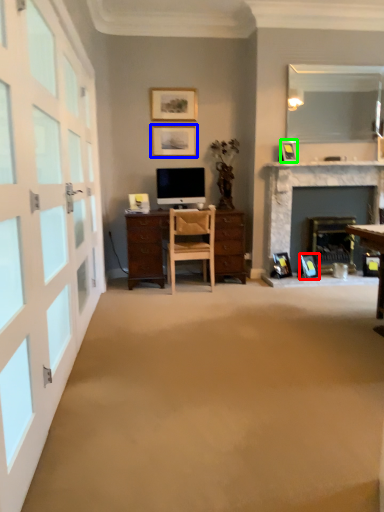
Question: Which is nearer to the picture frame (highlighted by a red box)? picture frame (highlighted by a blue box) or picture frame (highlighted by a green box).

Choices:
 (A) picture frame
 (B) picture frame

Answer: (B)